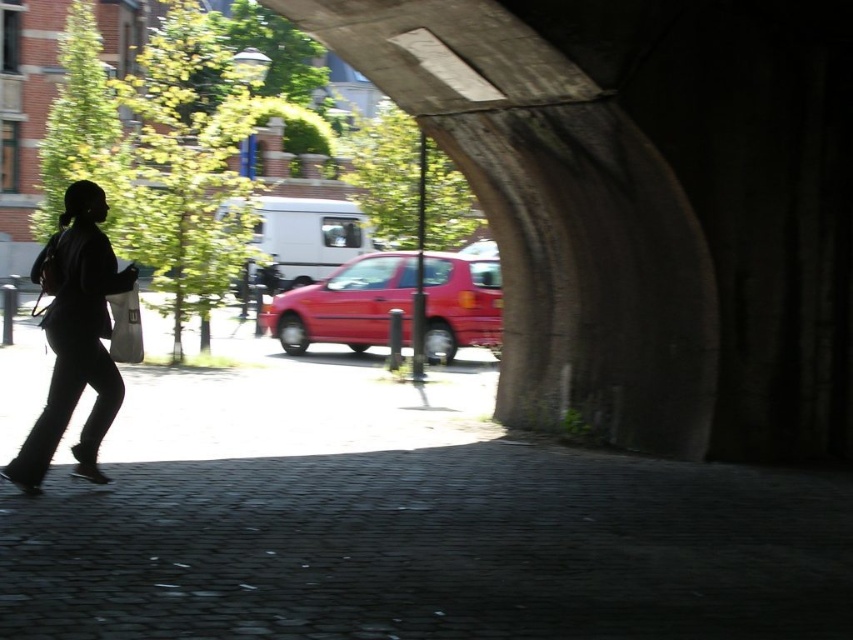
Does point (80, 196) come in front of point (361, 332)?

Yes, point (80, 196) is in front of point (361, 332).

Who is more distant from viewer, (56, 314) or (438, 308)?

Positioned behind is point (438, 308).

The height and width of the screenshot is (640, 853). What do you see at coordinates (74, 337) in the screenshot? I see `black fabric bag at left` at bounding box center [74, 337].

This screenshot has height=640, width=853. I want to click on black fabric bag at left, so click(x=74, y=337).